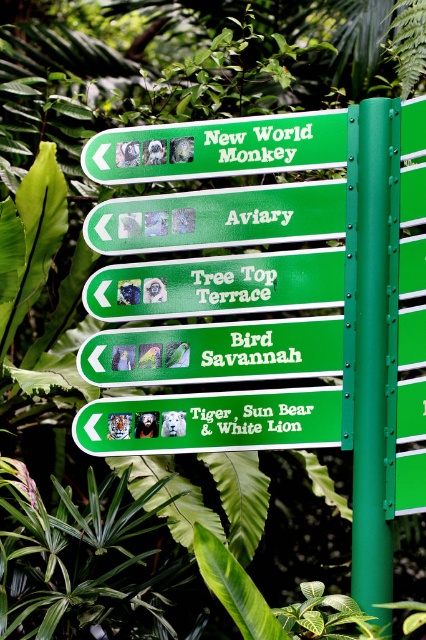
Question: Based on their relative distances, which object is nearer to the green plastic sign at upper center?

Choices:
 (A) green matte sign at center
 (B) green painted metal pole at center right

Answer: (A)

Question: Estimate the real-world distances between objects in this image. Which object is farther from the green plastic sign at center?

Choices:
 (A) green painted metal pole at center right
 (B) green matte sign at center
 (C) green plastic sign at upper center

Answer: (A)

Question: Among these points, which one is nearest to the camera?

Choices:
 (A) (152, 304)
 (B) (353, 352)
 (C) (249, 186)

Answer: (B)

Question: Is green matte sign at center closer to the viewer compared to green plastic sign at upper center?

Choices:
 (A) no
 (B) yes

Answer: (B)

Question: Is green plastic sign at upper center below green plastic sign at center?

Choices:
 (A) yes
 (B) no

Answer: (B)

Question: Does green matte sign at center appear over green plastic sign at upper center?

Choices:
 (A) yes
 (B) no

Answer: (B)